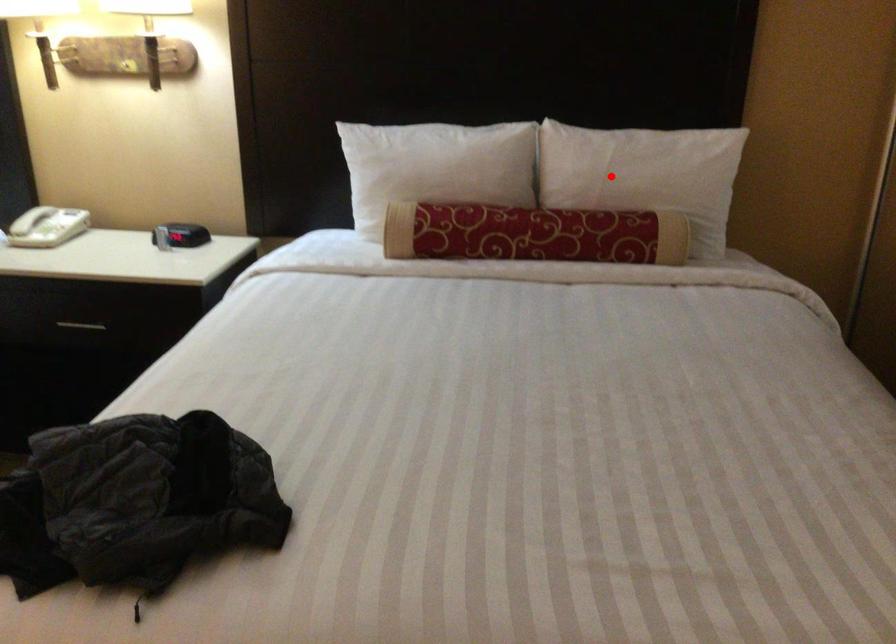
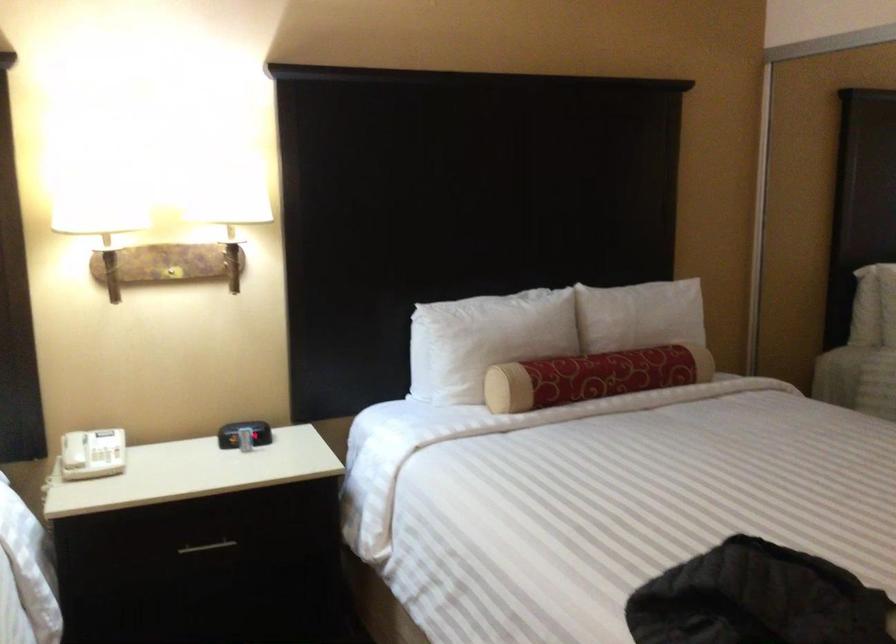
Locate, in the second image, the point that corresponds to the highlighted location in the first image.

(643, 319)